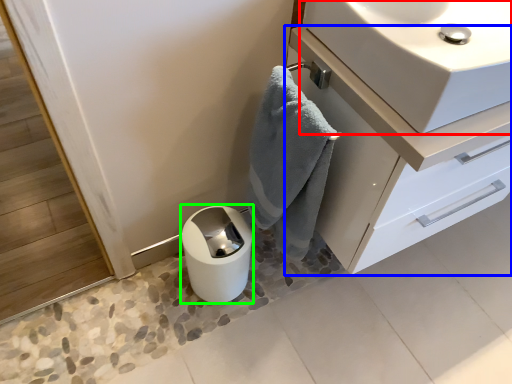
Question: Based on their relative distances, which object is nearer to sink (highlighted by a red box)? Choose from bathroom cabinet (highlighted by a blue box) and paper towel (highlighted by a green box).

Choices:
 (A) bathroom cabinet
 (B) paper towel

Answer: (A)